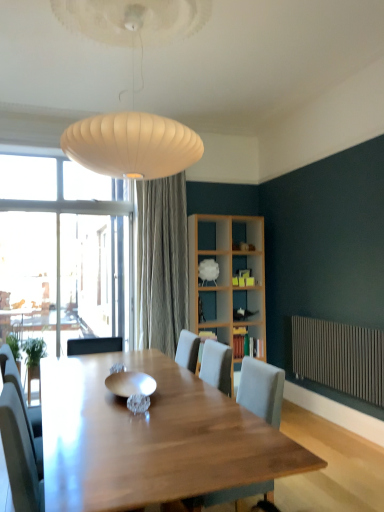
The image size is (384, 512). I want to click on vacant region above wooden bookshelf at center, the second shelf ordered from the bottom (from a real-world perspective), so click(209, 330).